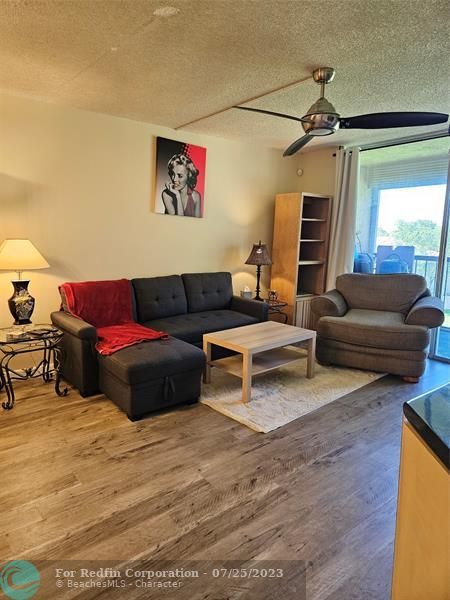
Where is `lamp`? The image size is (450, 600). lamp is located at coordinates (24, 285), (253, 272).